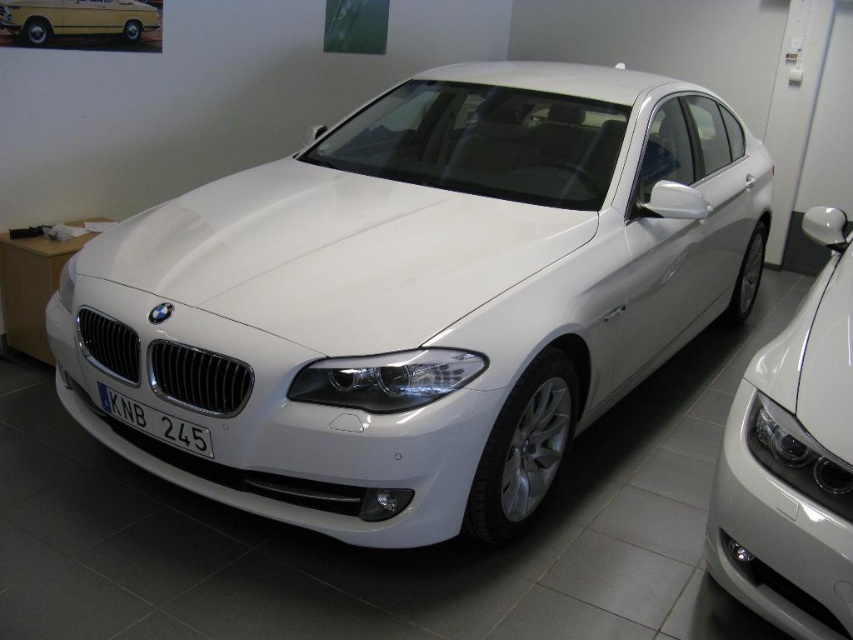
Is glossy white car at right taller than yellow matte car at upper left?

Correct, glossy white car at right is much taller as yellow matte car at upper left.

Is glossy white car at right behind yellow matte car at upper left?

No.

What do you see at coordinates (793, 461) in the screenshot? The height and width of the screenshot is (640, 853). I see `glossy white car at right` at bounding box center [793, 461].

Identify the location of glossy white car at right. Image resolution: width=853 pixels, height=640 pixels. (793, 461).

This screenshot has width=853, height=640. What do you see at coordinates (77, 19) in the screenshot?
I see `yellow matte car at upper left` at bounding box center [77, 19].

Which is in front, point (9, 17) or point (175, 445)?

Point (175, 445)

Locate an element on the screen. The image size is (853, 640). yellow matte car at upper left is located at coordinates [x=77, y=19].

Between white metallic car at center and glossy white car at right, which one is positioned lower?

glossy white car at right is below.

Can you confirm if white metallic car at center is wider than glossy white car at right?

Correct, the width of white metallic car at center exceeds that of glossy white car at right.

Where is `white metallic car at center`? The height and width of the screenshot is (640, 853). white metallic car at center is located at coordinates (421, 296).